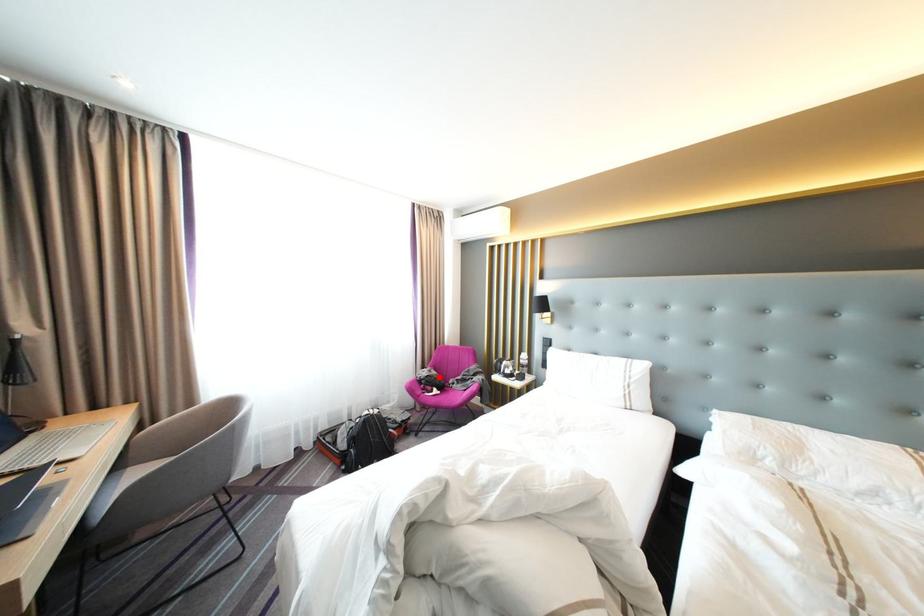
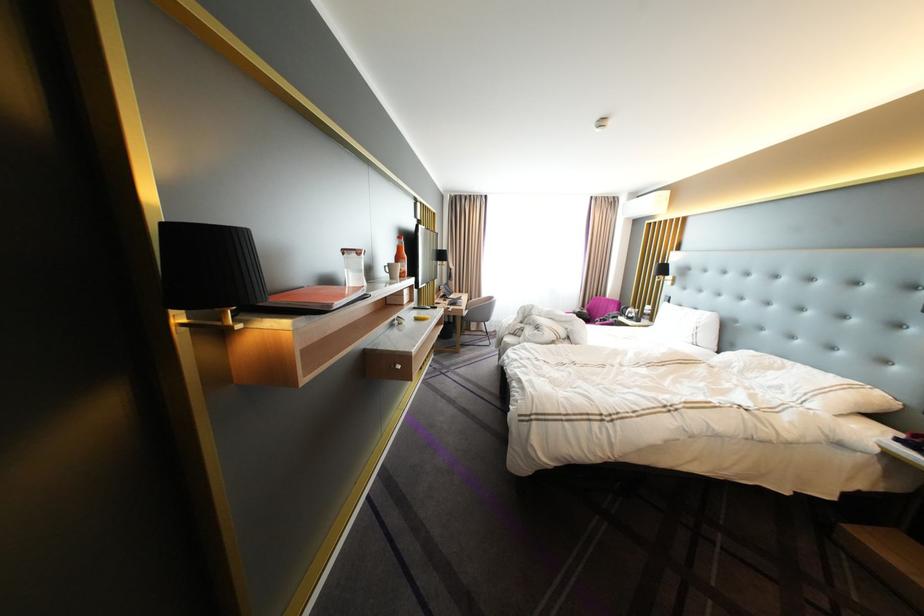
Question: I am providing you with two images of the same scene from different viewpoints. Given a red point in image1, look at the same physical point in image2. Is it:

Choices:
 (A) Closer to the viewpoint
 (B) Farther from the viewpoint

Answer: (B)